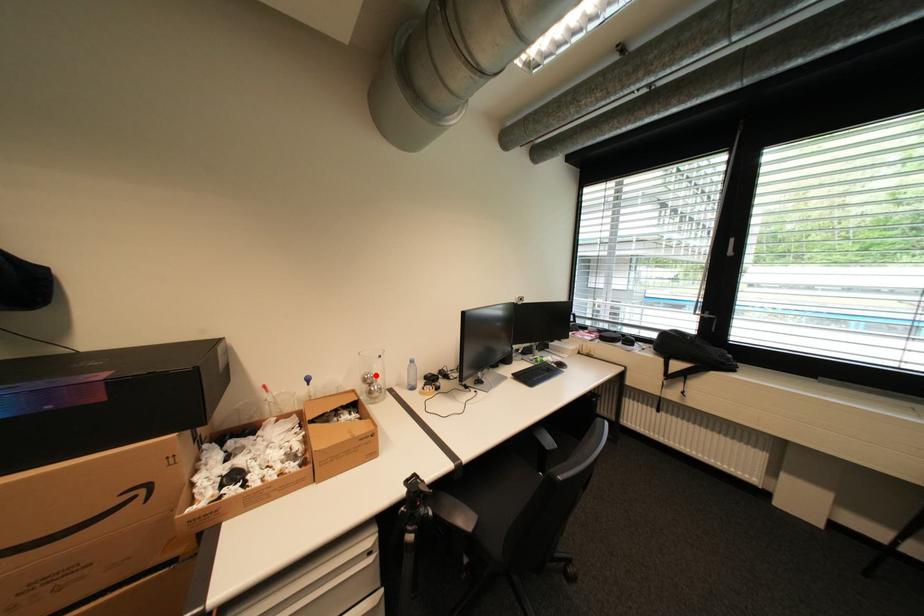
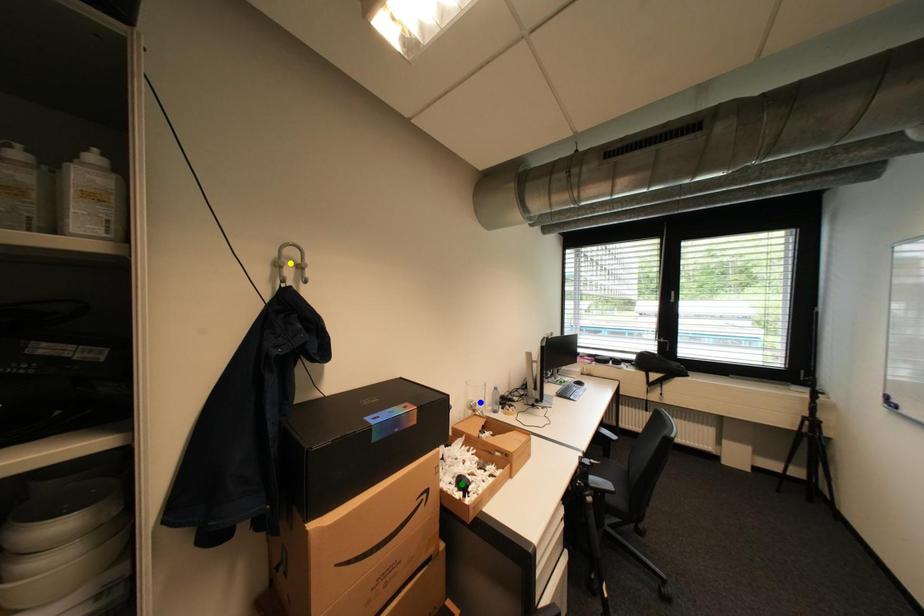
Question: I am providing you with two images of the same scene from different viewpoints. A red point is marked on the first image. You are given multiple points on the second image. In image 2, which mark is for the same physical point as the one in image 1?

Choices:
 (A) blue point
 (B) green point
 (C) yellow point

Answer: (A)